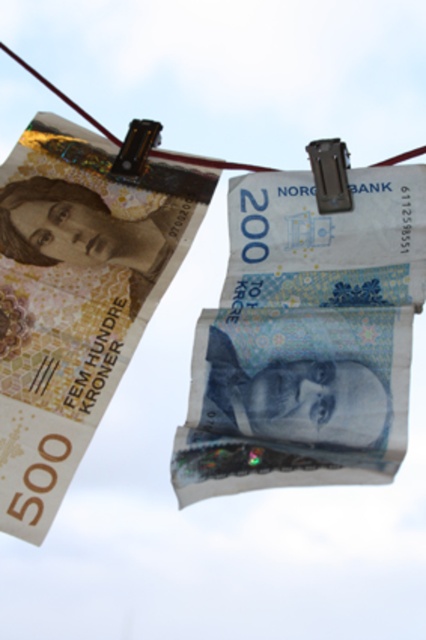
You are a currency collector who wants to hang two Norwegian banknotes on a clothesline. You have a blue paper currency at center and a matte paper banknote at upper left. According to the scene, which one is located to the right?

The blue paper currency at center is positioned on the right side of matte paper banknote at upper left, so the blue paper currency at center is located to the right.

You are a currency collector examining two banknotes on a clothesline. You see the blue paper currency at center and the matte paper banknote at upper left. Which banknote is located higher up on the clothesline?

The matte paper banknote at upper left is higher up on the clothesline than the blue paper currency at center.

You are standing in front of the two Norwegian banknotes hanging on the clothesline. You notice two points marked on the image. Which point, point (406, 346) or point (19, 241), is closer to you?

Point (406, 346) is closer to you because it is in front of point (19, 241).